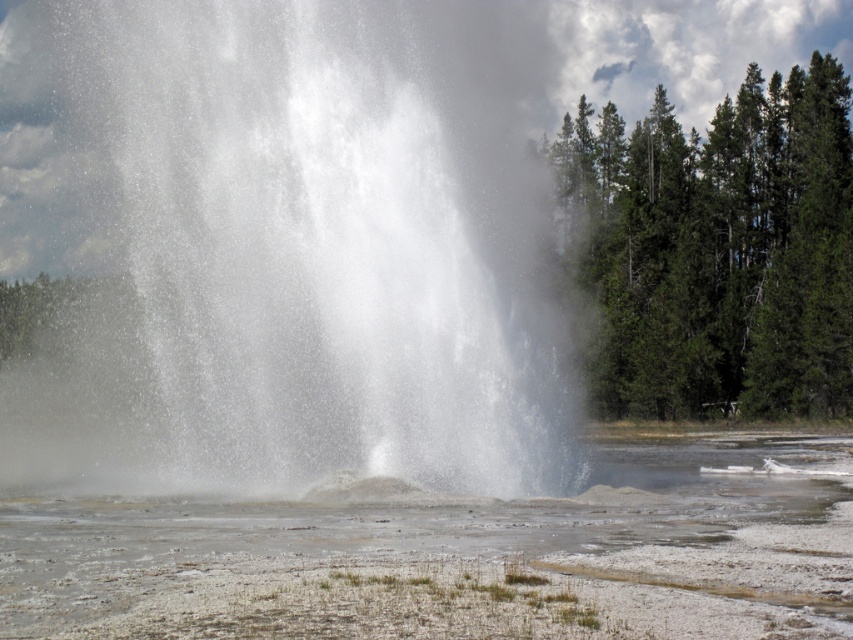
You are standing at the viewpoint of the image and want to reach the geyser. The geyser is located at the point labeled as point (453, 324). If you walk straight towards it, how far will you have to walk in feet?

The point (453, 324) is 71.31 feet away from the viewer, so you will have to walk 71.31 feet to reach the geyser.

You are a photographer trying to capture the geyser from a safe distance. The white vapor at center and white frothy water at center are both visible in your viewfinder. Which of these two elements is taller in the image?

The white vapor at center is taller than the white frothy water at center, so the white vapor at center appears taller in the image.

You are a photographer trying to capture the geyser eruption. You notice the white vapor at center and the white frothy water at center. Which one is located more to the left side?

The white vapor at center is positioned on the left side of white frothy water at center, so the white vapor at center is more to the left side.